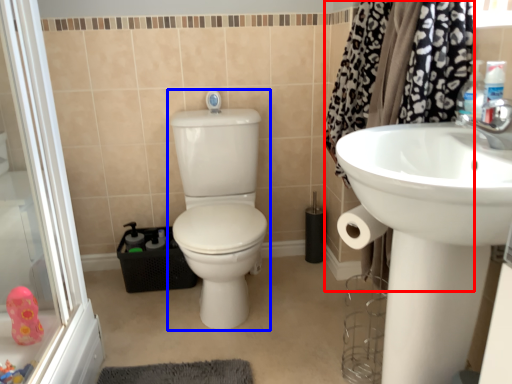
Question: Which point is closer to the camera, shower curtain (highlighted by a red box) or sit (highlighted by a blue box)?

Choices:
 (A) shower curtain
 (B) sit

Answer: (A)